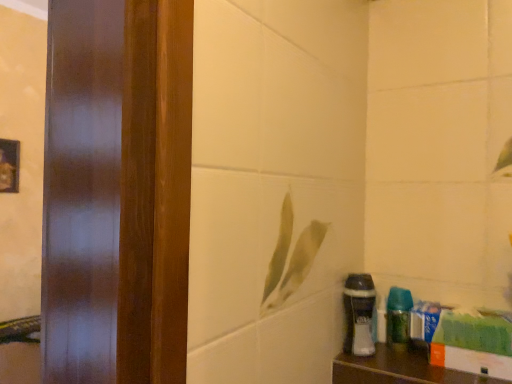
Question: Is wooden shelf at lower right in front of or behind white matte shaving cream at lower right in the image?

Choices:
 (A) front
 (B) behind

Answer: (A)

Question: In terms of size, does wooden shelf at lower right appear bigger or smaller than white matte shaving cream at lower right?

Choices:
 (A) small
 (B) big

Answer: (A)

Question: Estimate the real-world distances between objects in this image. Which object is farther from the green glossy spray bottle at lower right?

Choices:
 (A) wooden shelf at lower right
 (B) white matte shaving cream at lower right

Answer: (A)

Question: Considering the real-world distances, which object is farthest from the green glossy spray bottle at lower right?

Choices:
 (A) wooden shelf at lower right
 (B) white matte shaving cream at lower right

Answer: (A)